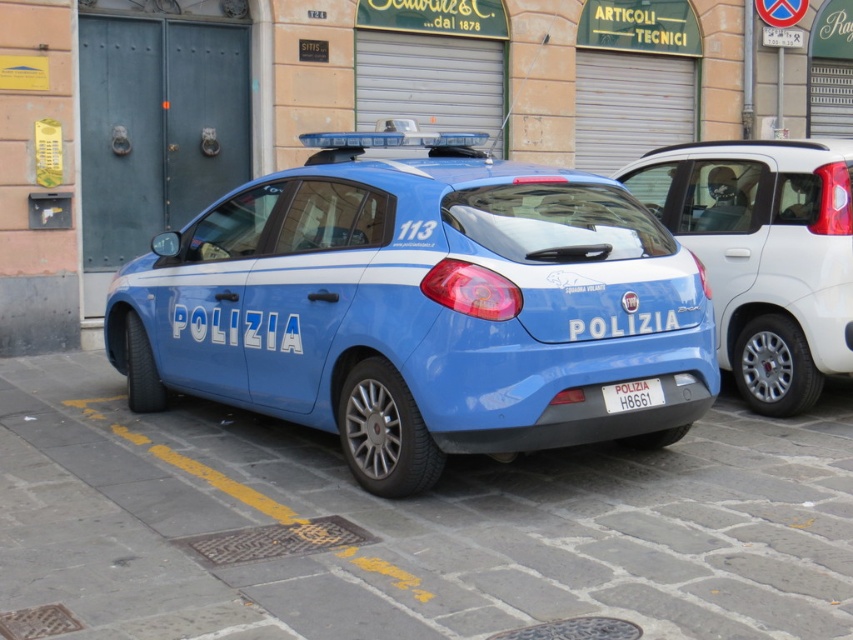
Does blue glossy car at center have a lesser height compared to white plastic license plate at center?

In fact, blue glossy car at center may be taller than white plastic license plate at center.

Which of these two, blue glossy car at center or white plastic license plate at center, stands shorter?

Standing shorter between the two is white plastic license plate at center.

Where is `blue glossy car at center`? blue glossy car at center is located at coordinates (764, 253).

Find the location of a particular element. This screenshot has width=853, height=640. blue glossy car at center is located at coordinates (764, 253).

Is matte blue car at center to the right of white plastic license plate at center from the viewer's perspective?

No, matte blue car at center is not to the right of white plastic license plate at center.

Image resolution: width=853 pixels, height=640 pixels. I want to click on matte blue car at center, so click(x=421, y=307).

Is point (567, 298) positioned before point (831, 337)?

Yes, it is in front of point (831, 337).

Is matte blue car at center thinner than blue glossy car at center?

No, matte blue car at center is not thinner than blue glossy car at center.

Where is `matte blue car at center`? This screenshot has height=640, width=853. matte blue car at center is located at coordinates (421, 307).